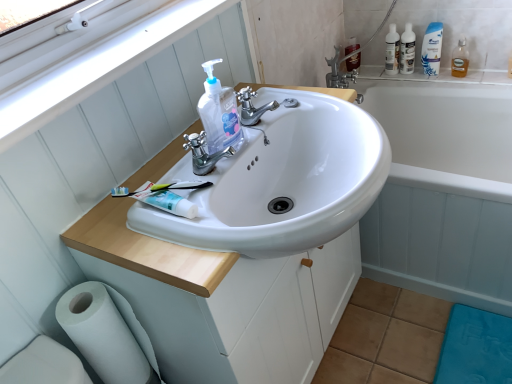
Locate an element on the screen. unoccupied region to the right of matte brown spray bottle at upper right, the second cleaning product when ordered from right to left is located at coordinates (381, 67).